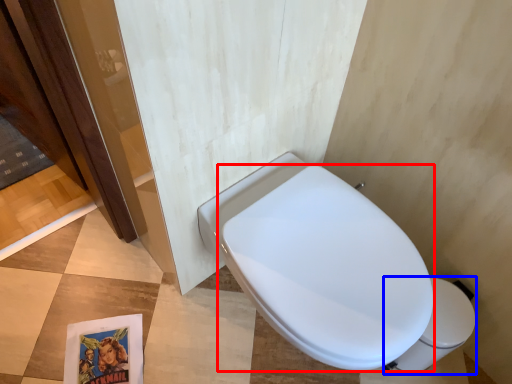
Question: Which of the following is the farthest to the observer, bidet (highlighted by a red box) or toilet bowl (highlighted by a blue box)?

Choices:
 (A) bidet
 (B) toilet bowl

Answer: (B)